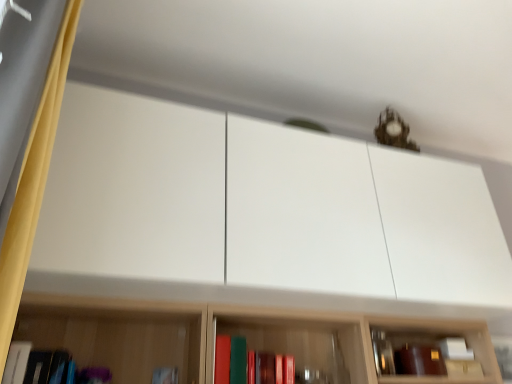
This screenshot has height=384, width=512. Describe the element at coordinates (250, 364) in the screenshot. I see `matte red book at center, the first book when ordered from right to left` at that location.

Identify the location of yellow fabric curtain at left. (33, 182).

Can you tell me how much matte black book at lower left, which is counted as the 1th book, starting from the left, and yellow fabric curtain at left differ in facing direction?

matte black book at lower left, which is counted as the 1th book, starting from the left, and yellow fabric curtain at left are facing 86.3 degrees away from each other.

From the picture: Who is taller, matte black book at lower left, which is counted as the 1th book, starting from the left, or yellow fabric curtain at left?

yellow fabric curtain at left.

From the picture: Considering the sizes of objects matte black book at lower left, which is counted as the 1th book, starting from the left, and yellow fabric curtain at left in the image provided, who is bigger, matte black book at lower left, which is counted as the 1th book, starting from the left, or yellow fabric curtain at left?

With larger size is yellow fabric curtain at left.

Does point (23, 348) lie behind point (37, 202)?

Yes, point (23, 348) is farther from viewer.

From the picture: Which object is positioned more to the left, matte red book at center, which is the third book from left to right, or yellow fabric curtain at left?

Positioned to the left is yellow fabric curtain at left.

Which point is more forward, (232, 352) or (13, 208)?

The point (13, 208) is more forward.

In terms of size, does matte red book at center, the first book when ordered from right to left, appear bigger or smaller than yellow fabric curtain at left?

Clearly, matte red book at center, the first book when ordered from right to left, is smaller in size than yellow fabric curtain at left.

From the image's perspective, which is above, matte red book at center, the first book when ordered from right to left, or yellow fabric curtain at left?

yellow fabric curtain at left appears higher in the image.

Is yellow fabric curtain at left oriented towards matte white book at lower left, marked as the second book in a right-to-left arrangement?

No, yellow fabric curtain at left is not turned towards matte white book at lower left, marked as the second book in a right-to-left arrangement.

From a real-world perspective, between yellow fabric curtain at left and matte white book at lower left, marked as the second book in a right-to-left arrangement, who is vertically higher?

From a 3D spatial view, yellow fabric curtain at left is above.

Is yellow fabric curtain at left to the left of matte white book at lower left, marked as the second book in a left-to-right arrangement, from the viewer's perspective?

Yes, yellow fabric curtain at left is to the left of matte white book at lower left, marked as the second book in a left-to-right arrangement.

From the picture: Looking at the image, does matte black book at lower left, which is counted as the 1th book, starting from the left, seem bigger or smaller compared to matte white book at lower left, marked as the second book in a right-to-left arrangement?

matte black book at lower left, which is counted as the 1th book, starting from the left, is bigger than matte white book at lower left, marked as the second book in a right-to-left arrangement.

Is matte black book at lower left, placed as the third book when sorted from right to left, not close to matte white book at lower left, marked as the second book in a left-to-right arrangement?

No.

In the scene shown: Is the position of matte black book at lower left, which is counted as the 1th book, starting from the left, more distant than that of matte white book at lower left, marked as the second book in a left-to-right arrangement?

No, matte black book at lower left, which is counted as the 1th book, starting from the left, is closer to the viewer.

Does matte red book at center, the first book when ordered from right to left, touch matte white book at lower left, marked as the second book in a right-to-left arrangement?

No, matte red book at center, the first book when ordered from right to left, is not making contact with matte white book at lower left, marked as the second book in a right-to-left arrangement.

How many degrees apart are the facing directions of matte red book at center, which is the third book from left to right, and matte white book at lower left, marked as the second book in a right-to-left arrangement?

The angular difference between matte red book at center, which is the third book from left to right, and matte white book at lower left, marked as the second book in a right-to-left arrangement, is 5.09 degrees.

Which point is more forward, (227, 348) or (165, 382)?

The point (165, 382) is more forward.

Between matte red book at center, the first book when ordered from right to left, and matte white book at lower left, marked as the second book in a right-to-left arrangement, which one has less height?

matte red book at center, the first book when ordered from right to left, is shorter.

Is yellow fabric curtain at left oriented towards matte black book at lower left, placed as the third book when sorted from right to left?

No, yellow fabric curtain at left is not aimed at matte black book at lower left, placed as the third book when sorted from right to left.

Is yellow fabric curtain at left positioned beyond the bounds of matte black book at lower left, which is counted as the 1th book, starting from the left?

That's correct, yellow fabric curtain at left is outside of matte black book at lower left, which is counted as the 1th book, starting from the left.

Can you confirm if yellow fabric curtain at left is positioned to the right of matte black book at lower left, placed as the third book when sorted from right to left?

Correct, you'll find yellow fabric curtain at left to the right of matte black book at lower left, placed as the third book when sorted from right to left.

From the image's perspective, is matte red book at center, the first book when ordered from right to left, on matte black book at lower left, which is counted as the 1th book, starting from the left?

No, from the image's perspective, matte red book at center, the first book when ordered from right to left, is not above matte black book at lower left, which is counted as the 1th book, starting from the left.

Would you say matte red book at center, the first book when ordered from right to left, is outside matte black book at lower left, which is counted as the 1th book, starting from the left?

That's correct, matte red book at center, the first book when ordered from right to left, is outside of matte black book at lower left, which is counted as the 1th book, starting from the left.

Could you tell me if matte red book at center, which is the third book from left to right, is turned towards matte black book at lower left, placed as the third book when sorted from right to left?

No, matte red book at center, which is the third book from left to right, does not turn towards matte black book at lower left, placed as the third book when sorted from right to left.

Is point (240, 370) positioned after point (25, 343)?

Yes.

Identify the location of the 2nd book located beneath the yellow fabric curtain at left (from a real-world perspective). Image resolution: width=512 pixels, height=384 pixels. (34, 365).

I want to click on book that is the 2nd one when counting backward from the yellow fabric curtain at left, so click(x=250, y=364).

Which object lies further to the anchor point matte white book at lower left, marked as the second book in a right-to-left arrangement, matte red book at center, the first book when ordered from right to left, or matte black book at lower left, placed as the third book when sorted from right to left?

The object further to matte white book at lower left, marked as the second book in a right-to-left arrangement, is matte black book at lower left, placed as the third book when sorted from right to left.

Estimate the real-world distances between objects in this image. Which object is further from matte black book at lower left, which is counted as the 1th book, starting from the left, matte white book at lower left, marked as the second book in a right-to-left arrangement, or matte red book at center, the first book when ordered from right to left?

The object further to matte black book at lower left, which is counted as the 1th book, starting from the left, is matte red book at center, the first book when ordered from right to left.

Which object lies nearer to the anchor point matte black book at lower left, placed as the third book when sorted from right to left, matte red book at center, the first book when ordered from right to left, or yellow fabric curtain at left?

yellow fabric curtain at left is positioned closer to the anchor matte black book at lower left, placed as the third book when sorted from right to left.

Looking at the image, which one is located closer to matte red book at center, which is the third book from left to right, matte white book at lower left, marked as the second book in a right-to-left arrangement, or yellow fabric curtain at left?

The object closer to matte red book at center, which is the third book from left to right, is matte white book at lower left, marked as the second book in a right-to-left arrangement.

Looking at the image, which one is located further to matte red book at center, which is the third book from left to right, matte white book at lower left, marked as the second book in a right-to-left arrangement, or matte black book at lower left, placed as the third book when sorted from right to left?

The object further to matte red book at center, which is the third book from left to right, is matte black book at lower left, placed as the third book when sorted from right to left.

Based on their spatial positions, is matte white book at lower left, marked as the second book in a left-to-right arrangement, or matte red book at center, which is the third book from left to right, further from yellow fabric curtain at left?

Based on the image, matte red book at center, which is the third book from left to right, appears to be further to yellow fabric curtain at left.

Looking at the image, which one is located further to matte white book at lower left, marked as the second book in a left-to-right arrangement, matte black book at lower left, which is counted as the 1th book, starting from the left, or matte red book at center, the first book when ordered from right to left?

matte black book at lower left, which is counted as the 1th book, starting from the left.

Estimate the real-world distances between objects in this image. Which object is closer to matte black book at lower left, placed as the third book when sorted from right to left, yellow fabric curtain at left or matte white book at lower left, marked as the second book in a left-to-right arrangement?

Based on the image, matte white book at lower left, marked as the second book in a left-to-right arrangement, appears to be nearer to matte black book at lower left, placed as the third book when sorted from right to left.

Locate an element on the screen. book between matte black book at lower left, placed as the third book when sorted from right to left, and matte red book at center, which is the third book from left to right is located at coordinates (165, 375).

I want to click on book between yellow fabric curtain at left and matte red book at center, which is the third book from left to right, vertically, so click(34, 365).